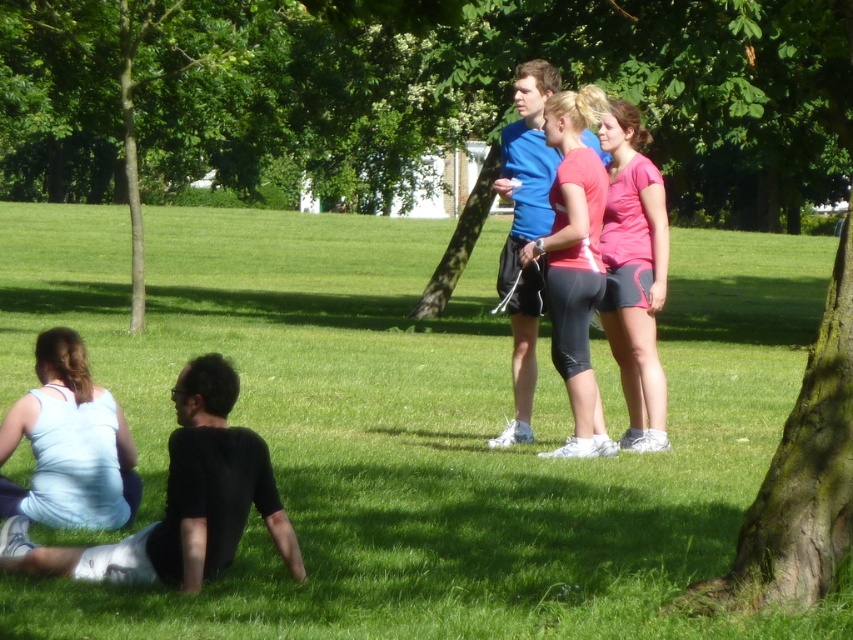
You are standing at the edge of the park and see the light blue fabric at lower left and the pink fabric shorts at center. Which one is nearer to you?

The light blue fabric at lower left is closer to the viewer than the pink fabric shorts at center.